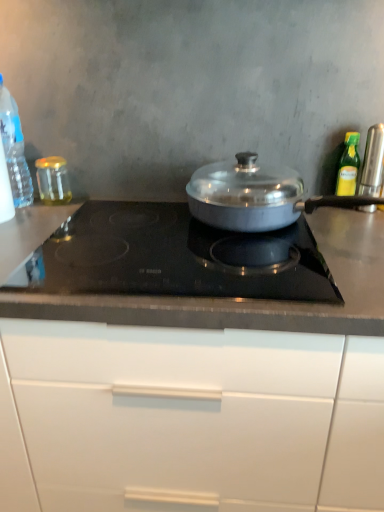
Question: Considering the relative positions of clear plastic bottle at left, the 1th kitchen appliance viewed from the left, and translucent glass jar at left, placed as the 4th kitchen appliance when sorted from right to left, in the image provided, is clear plastic bottle at left, the 1th kitchen appliance viewed from the left, to the right of translucent glass jar at left, placed as the 4th kitchen appliance when sorted from right to left, from the viewer's perspective?

Choices:
 (A) yes
 (B) no

Answer: (B)

Question: Would you say clear plastic bottle at left, the 1th kitchen appliance viewed from the left, contains translucent glass jar at left, placed as the 4th kitchen appliance when sorted from right to left?

Choices:
 (A) yes
 (B) no

Answer: (B)

Question: Is clear plastic bottle at left, the fifth kitchen appliance from the right, looking in the opposite direction of translucent glass jar at left, marked as the second kitchen appliance in a left-to-right arrangement?

Choices:
 (A) no
 (B) yes

Answer: (A)

Question: Would you say clear plastic bottle at left, the 1th kitchen appliance viewed from the left, is a long distance from translucent glass jar at left, marked as the second kitchen appliance in a left-to-right arrangement?

Choices:
 (A) yes
 (B) no

Answer: (B)

Question: Does clear plastic bottle at left, the 1th kitchen appliance viewed from the left, have a lesser height compared to translucent glass jar at left, placed as the 4th kitchen appliance when sorted from right to left?

Choices:
 (A) yes
 (B) no

Answer: (B)

Question: Is clear plastic bottle at left, the fifth kitchen appliance from the right, taller than translucent glass jar at left, marked as the second kitchen appliance in a left-to-right arrangement?

Choices:
 (A) no
 (B) yes

Answer: (B)

Question: Considering the relative sizes of white glossy cabinet at center and black glass cooktop at center in the image provided, is white glossy cabinet at center bigger than black glass cooktop at center?

Choices:
 (A) yes
 (B) no

Answer: (A)

Question: Considering the relative positions of white glossy cabinet at center and black glass cooktop at center in the image provided, is white glossy cabinet at center in front of black glass cooktop at center?

Choices:
 (A) no
 (B) yes

Answer: (B)

Question: Could you tell me if white glossy cabinet at center is facing black glass cooktop at center?

Choices:
 (A) no
 (B) yes

Answer: (A)

Question: Is white glossy cabinet at center facing away from black glass cooktop at center?

Choices:
 (A) yes
 (B) no

Answer: (B)

Question: Considering the relative positions of white glossy cabinet at center and black glass cooktop at center in the image provided, is white glossy cabinet at center to the right of black glass cooktop at center from the viewer's perspective?

Choices:
 (A) no
 (B) yes

Answer: (A)

Question: Does white glossy cabinet at center have a greater width compared to black glass cooktop at center?

Choices:
 (A) no
 (B) yes

Answer: (B)

Question: From the image's perspective, would you say black glass cooktop at center is positioned over satin silver canister at right, which is the fifth kitchen appliance from left to right?

Choices:
 (A) no
 (B) yes

Answer: (A)